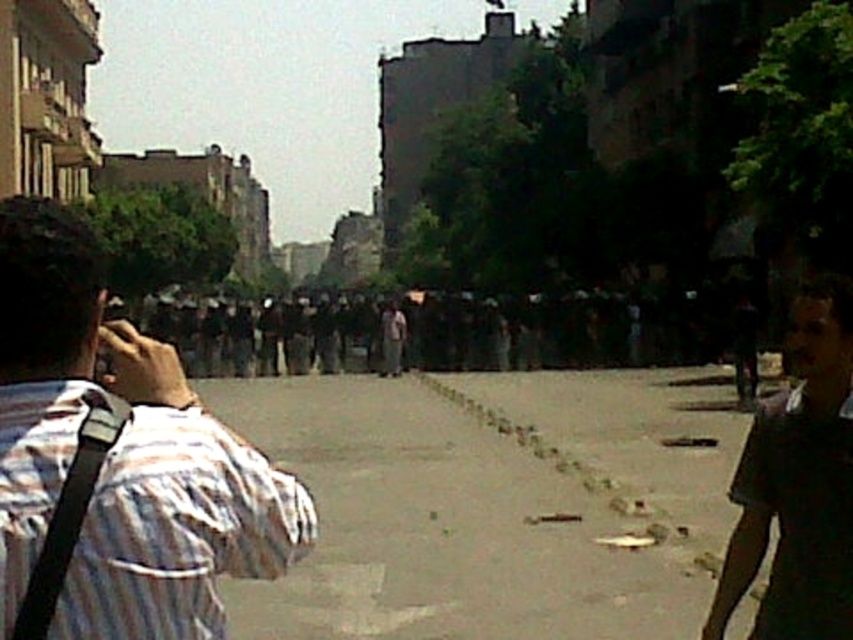
You are a pedestrian trying to cross the street in the image. You need to step on the gray concrete pavement at center and avoid the dark brown shirt at lower right. Can you walk straight ahead from your current position to reach the pavement?

The gray concrete pavement at center is positioned on the left side of dark brown shirt at lower right, so yes, you can walk straight ahead to reach the gray concrete pavement at center without stepping on the dark brown shirt at lower right.